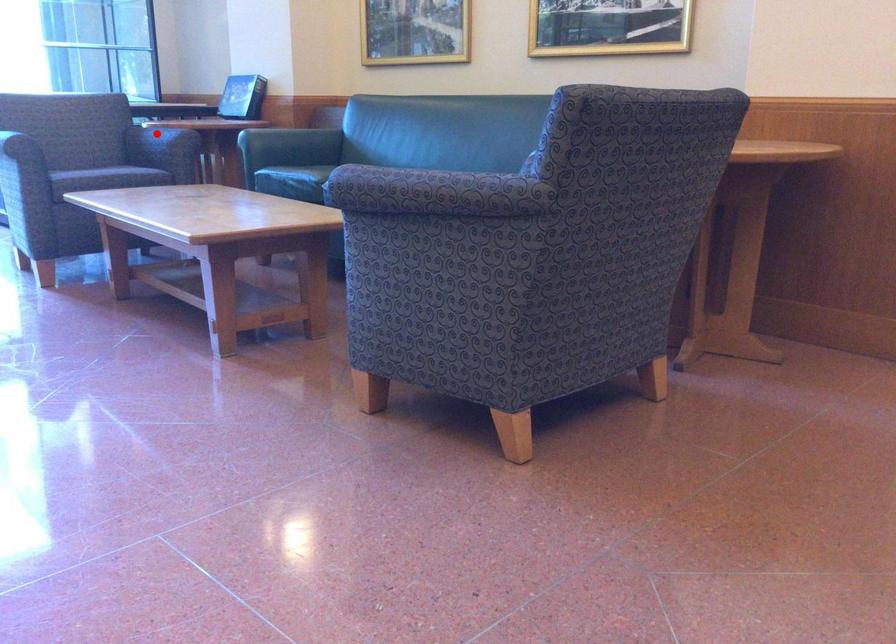
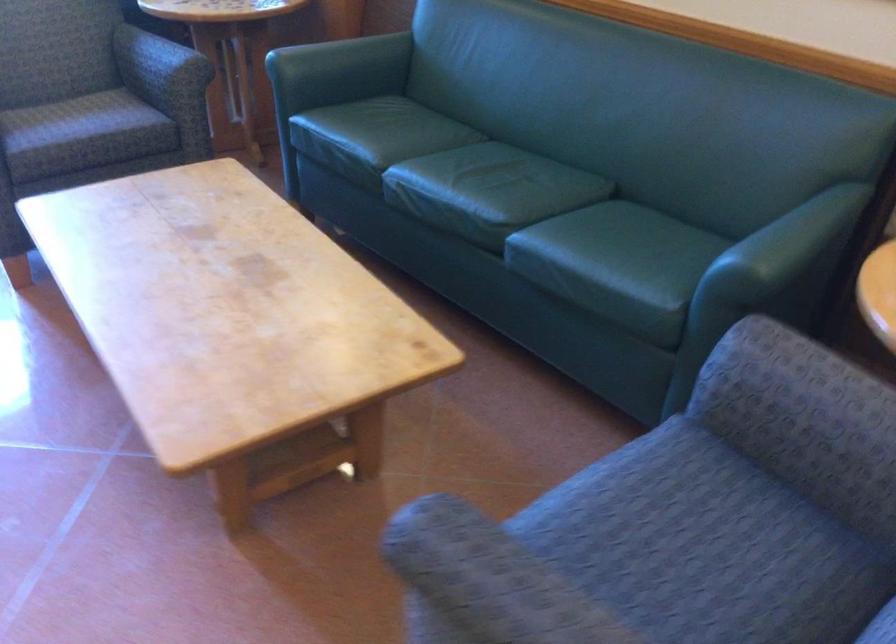
The point at the highlighted location is marked in the first image. Where is the corresponding point in the second image?

(158, 62)